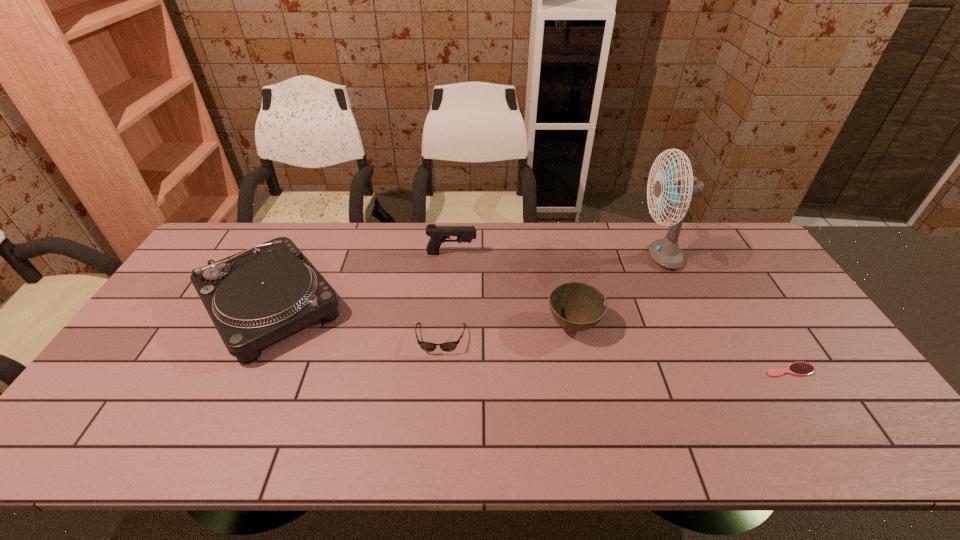
This screenshot has width=960, height=540. Find the location of `vacant area that lies between the pistol and the tallest object`. vacant area that lies between the pistol and the tallest object is located at coordinates (556, 255).

I want to click on free space between the bowl and the fifth object from left to right, so click(616, 291).

At what (x,y) coordinates should I click in order to perform the action: click on vacant area that lies between the hairbrush and the tallest object. Please return your answer as a coordinate pair (x, y). Looking at the image, I should click on (725, 313).

This screenshot has width=960, height=540. Find the location of `vacant area that lies between the hairbrush and the leftmost object`. vacant area that lies between the hairbrush and the leftmost object is located at coordinates (530, 338).

Identify the location of vacant space that's between the leftmost object and the fifth tallest object. This screenshot has width=960, height=540. (355, 322).

Locate which object ranks second in proximity to the pistol. Please provide its 2D coordinates. Your answer should be formatted as a tuple, i.e. [(x, y)], where the tuple contains the x and y coordinates of a point satisfying the conditions above.

[(426, 346)]

The width and height of the screenshot is (960, 540). I want to click on object that stands as the closest to the bowl, so click(666, 252).

This screenshot has width=960, height=540. I want to click on free space that satisfies the following two spatial constraints: 1. at the barrel of the pistol; 2. on the front-facing side of the fifth tallest object, so [445, 339].

What are the coordinates of `vacant space that satisfies the following two spatial constraints: 1. on the front-facing side of the fan; 2. on the front side of the record player` in the screenshot? It's located at (683, 305).

Locate an element on the screen. The image size is (960, 540). blank space that satisfies the following two spatial constraints: 1. on the front-facing side of the hairbrush; 2. on the left side of the second shortest object is located at coordinates (438, 370).